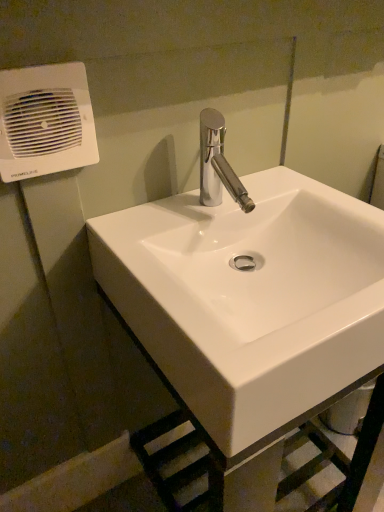
Question: Are white glossy sink at center and white plastic air conditioning at upper left located far from each other?

Choices:
 (A) yes
 (B) no

Answer: (B)

Question: Is white plastic air conditioning at upper left at the back of white glossy sink at center?

Choices:
 (A) no
 (B) yes

Answer: (A)

Question: Is white glossy sink at center smaller than white plastic air conditioning at upper left?

Choices:
 (A) yes
 (B) no

Answer: (B)

Question: From a real-world perspective, is white glossy sink at center positioned over white plastic air conditioning at upper left based on gravity?

Choices:
 (A) yes
 (B) no

Answer: (B)

Question: Can you confirm if white glossy sink at center is bigger than white plastic air conditioning at upper left?

Choices:
 (A) yes
 (B) no

Answer: (A)

Question: Does white glossy sink at center appear on the left side of white plastic air conditioning at upper left?

Choices:
 (A) yes
 (B) no

Answer: (B)

Question: Is white plastic air conditioning at upper left positioned with its back to white glossy sink at center?

Choices:
 (A) yes
 (B) no

Answer: (B)

Question: Can white glossy sink at center be found inside white plastic air conditioning at upper left?

Choices:
 (A) yes
 (B) no

Answer: (B)

Question: Does white plastic air conditioning at upper left have a lesser height compared to white glossy sink at center?

Choices:
 (A) yes
 (B) no

Answer: (A)

Question: Is white plastic air conditioning at upper left not near white glossy sink at center?

Choices:
 (A) no
 (B) yes

Answer: (A)

Question: Considering the relative positions of white plastic air conditioning at upper left and white glossy sink at center in the image provided, is white plastic air conditioning at upper left to the right of white glossy sink at center from the viewer's perspective?

Choices:
 (A) yes
 (B) no

Answer: (B)

Question: Is white plastic air conditioning at upper left positioned in front of white glossy sink at center?

Choices:
 (A) no
 (B) yes

Answer: (A)

Question: From a real-world perspective, relative to white glossy sink at center, is white plastic air conditioning at upper left vertically above or below?

Choices:
 (A) above
 (B) below

Answer: (A)